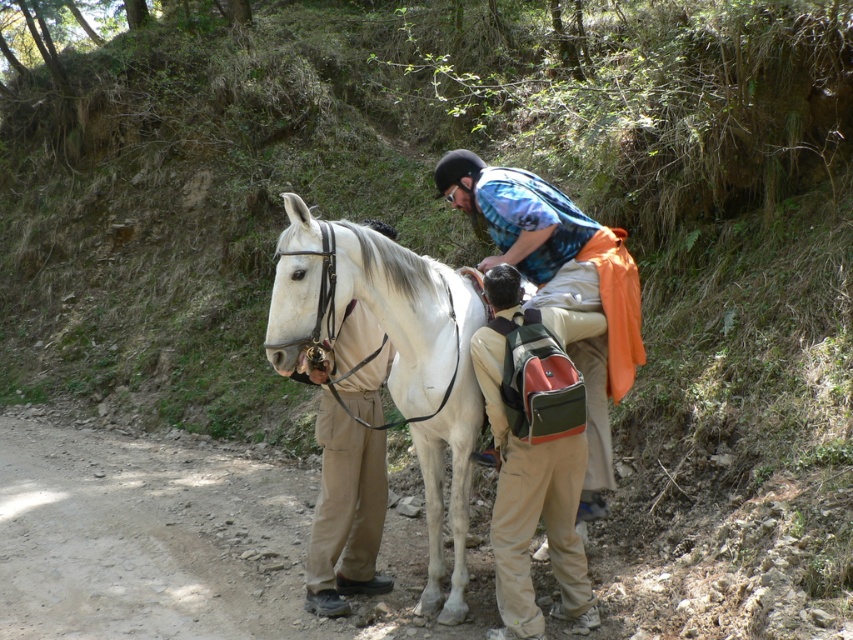
Question: In this image, where is khaki cotton pants at center located relative to matte white pants at center?

Choices:
 (A) above
 (B) below

Answer: (A)

Question: Which object appears farthest from the camera in this image?

Choices:
 (A) matte white pants at center
 (B) khaki cotton pants at center

Answer: (A)

Question: Which object is closer to the camera taking this photo?

Choices:
 (A) matte white pants at center
 (B) white glossy horse at center

Answer: (B)

Question: Which point is farther from the camera taking this photo?

Choices:
 (A) (463, 605)
 (B) (360, 433)

Answer: (B)

Question: Can you confirm if white glossy horse at center is wider than khaki cotton pants at center?

Choices:
 (A) no
 (B) yes

Answer: (B)

Question: Where is khaki cotton pants at center located in relation to matte white pants at center in the image?

Choices:
 (A) right
 (B) left

Answer: (A)